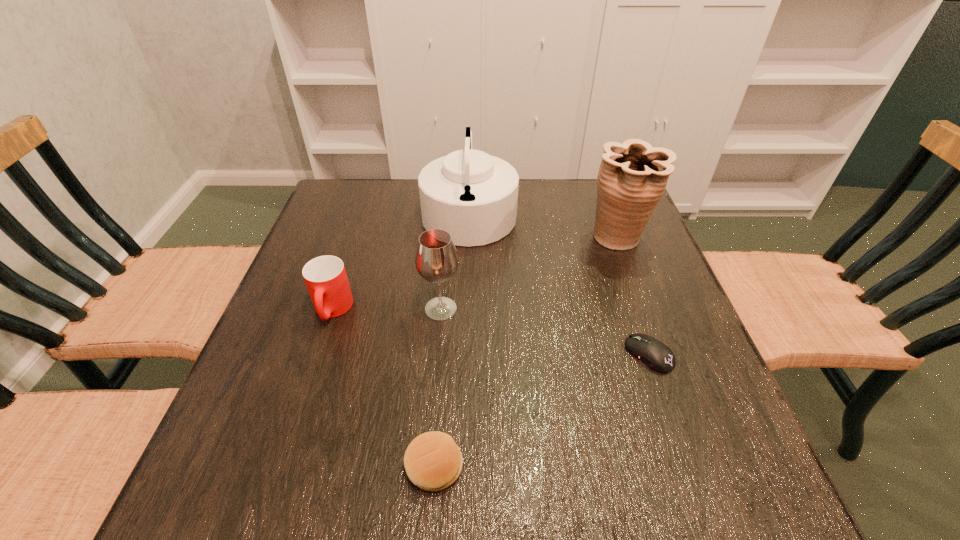
Image resolution: width=960 pixels, height=540 pixels. What are the coordinates of `computer equipment positioned at the right edge` in the screenshot? It's located at (656, 355).

Locate an element on the screen. The width and height of the screenshot is (960, 540). object located in the far right corner section of the desktop is located at coordinates (632, 178).

Where is `vacant position at the far edge of the desktop`? vacant position at the far edge of the desktop is located at coordinates (552, 188).

This screenshot has width=960, height=540. I want to click on vacant position at the near edge of the desktop, so click(624, 486).

The width and height of the screenshot is (960, 540). I want to click on vacant space at the left edge, so click(x=349, y=232).

Where is `free point at the right edge`? free point at the right edge is located at coordinates (648, 326).

Where is `vacant region at the far left corner`? vacant region at the far left corner is located at coordinates (340, 212).

In the image, there is a desktop. Identify the location of vacant region at the near left corner. The width and height of the screenshot is (960, 540). (204, 478).

In the image, there is a desktop. Where is `vacant space at the near right corner`? The height and width of the screenshot is (540, 960). vacant space at the near right corner is located at coordinates (734, 504).

You are a GUI agent. You are given a task and a screenshot of the screen. Output one action in this format:
    pyautogui.click(x=<x>, y=<y>)
    Task: Click on the free spot between the urn and the wineglass
    The width and height of the screenshot is (960, 540).
    Given the screenshot: What is the action you would take?
    pyautogui.click(x=530, y=273)